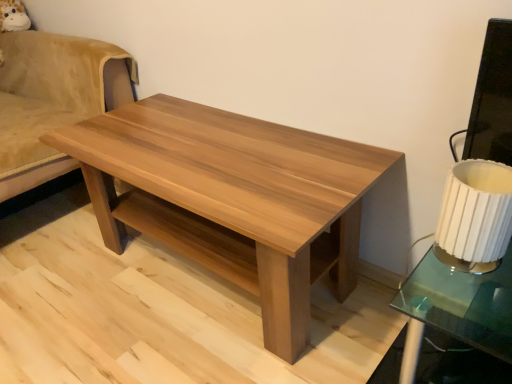
What are the coordinates of `vacant space situated above natural wood coffee table at center (from a real-world perspective)` in the screenshot? It's located at (210, 141).